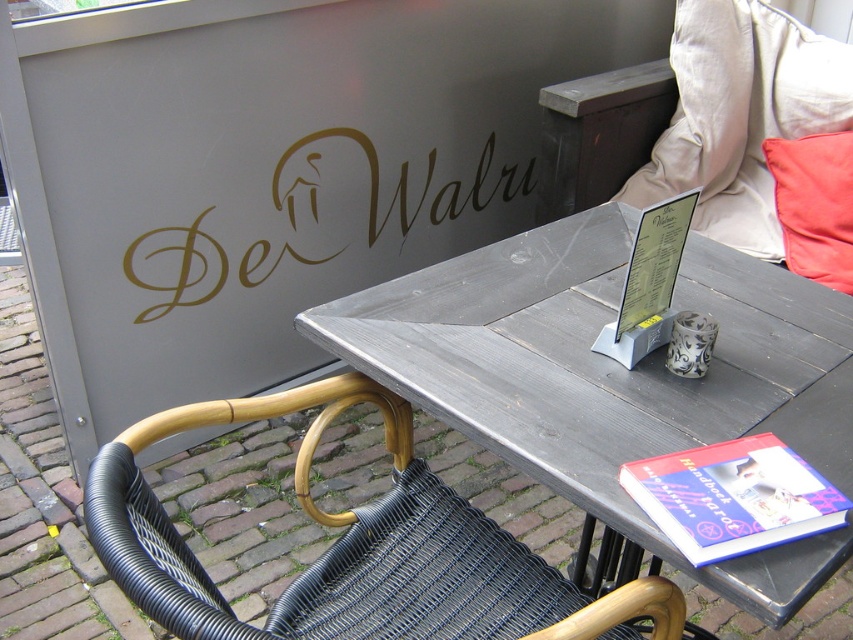
Question: Among these points, which one is farthest from the camera?

Choices:
 (A) (193, 243)
 (B) (778, 276)

Answer: (A)

Question: Which point is closer to the camera?

Choices:
 (A) red fabric pillow at upper right
 (B) dark gray wood table at center
 (C) gold metallic sign at upper center
 (D) blue hardcover book at lower right

Answer: (B)

Question: Does black wicker chair at lower left appear on the right side of red fabric pillow at upper right?

Choices:
 (A) no
 (B) yes

Answer: (A)

Question: Can you confirm if gold metallic sign at upper center is positioned below red fabric pillow at upper right?

Choices:
 (A) no
 (B) yes

Answer: (A)

Question: Is the position of black wicker chair at lower left more distant than that of red fabric pillow at upper right?

Choices:
 (A) no
 (B) yes

Answer: (A)

Question: Which object is closer to the camera taking this photo?

Choices:
 (A) gold metallic sign at upper center
 (B) red fabric pillow at upper right
 (C) dark gray wood table at center

Answer: (C)